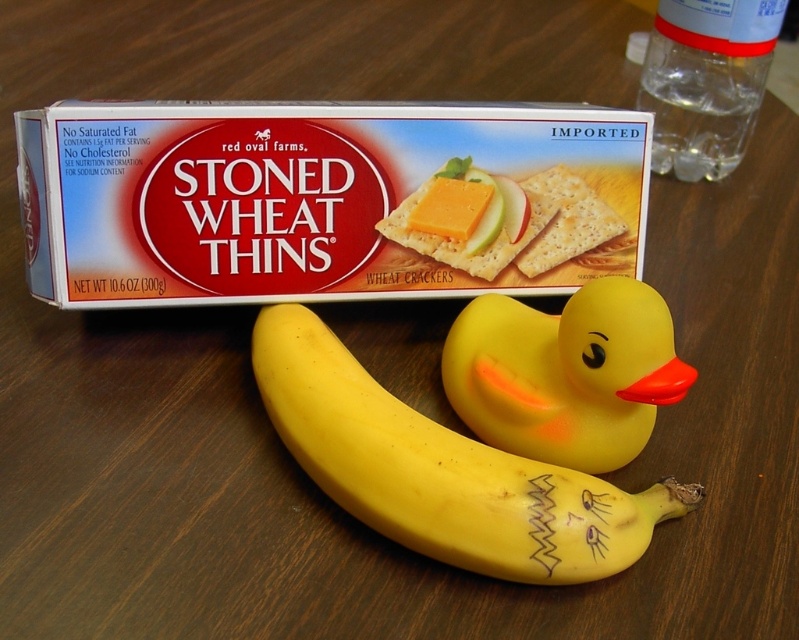
Is transparent plastic bottle at upper right to the left of yellow cheese at center from the viewer's perspective?

In fact, transparent plastic bottle at upper right is to the right of yellow cheese at center.

Does transparent plastic bottle at upper right have a smaller size compared to yellow cheese at center?

Actually, transparent plastic bottle at upper right might be larger than yellow cheese at center.

Which is in front, point (696, 60) or point (460, 224)?

Positioned in front is point (460, 224).

Locate an element on the screen. The height and width of the screenshot is (640, 799). transparent plastic bottle at upper right is located at coordinates (706, 81).

Between yellow matte banana at center and transparent plastic bottle at upper right, which one has more height?

yellow matte banana at center is taller.

Is yellow matte banana at center bigger than transparent plastic bottle at upper right?

Indeed, yellow matte banana at center has a larger size compared to transparent plastic bottle at upper right.

Which is in front, point (368, 448) or point (664, 156)?

Point (368, 448)

Image resolution: width=799 pixels, height=640 pixels. I want to click on yellow matte banana at center, so click(x=442, y=470).

Is yellow matte banana at center wider than yellow cheese at center?

Indeed, yellow matte banana at center has a greater width compared to yellow cheese at center.

Is yellow matte banana at center thinner than yellow cheese at center?

No, yellow matte banana at center is not thinner than yellow cheese at center.

Measure the distance between point (317, 317) and camera.

1.31 meters

Identify the location of yellow matte banana at center. (442, 470).